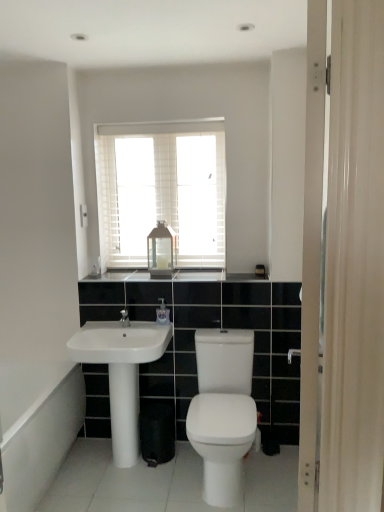
Where is `vacant space underneath white glossy pillar at center (from a real-world perspective)`? The image size is (384, 512). vacant space underneath white glossy pillar at center (from a real-world perspective) is located at coordinates (115, 462).